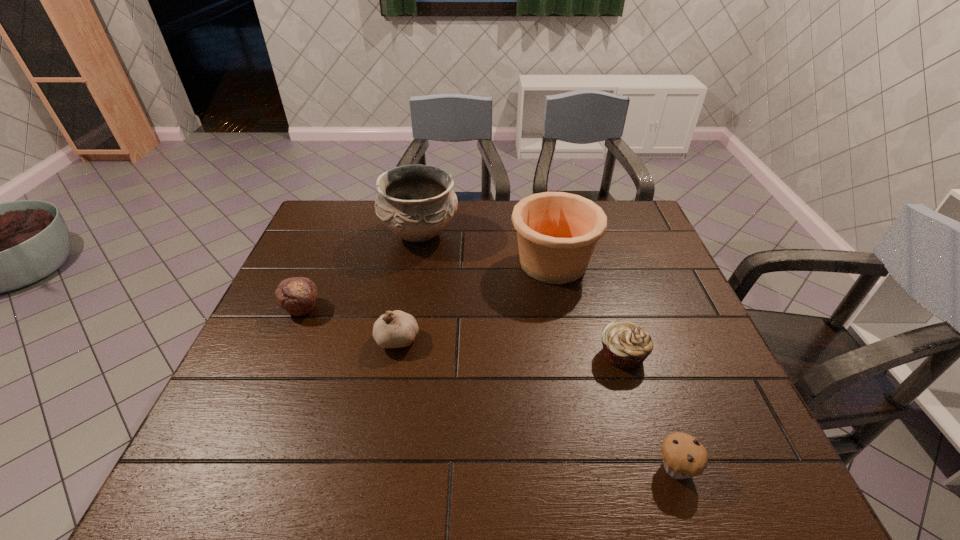
I want to click on vacant area situated on the left of the garlic, so click(251, 339).

The height and width of the screenshot is (540, 960). Identify the location of free space located 0.050m on the back of the farthest muffin. (313, 283).

Where is `free spot located 0.090m on the back of the second farthest muffin`? The height and width of the screenshot is (540, 960). free spot located 0.090m on the back of the second farthest muffin is located at coordinates (x=609, y=311).

Locate an element on the screen. The height and width of the screenshot is (540, 960). free space located on the back of the shortest object is located at coordinates (x=652, y=396).

Identify the location of object present at the near edge. (683, 456).

Where is `object at the left edge`? This screenshot has height=540, width=960. object at the left edge is located at coordinates (297, 295).

Locate an element on the screen. object located at the right edge is located at coordinates (683, 456).

The width and height of the screenshot is (960, 540). Identify the location of object located in the near right corner section of the desktop. (683, 456).

Where is `blank space at the far edge`? blank space at the far edge is located at coordinates (498, 201).

I want to click on vacant space at the near edge of the desktop, so click(x=554, y=468).